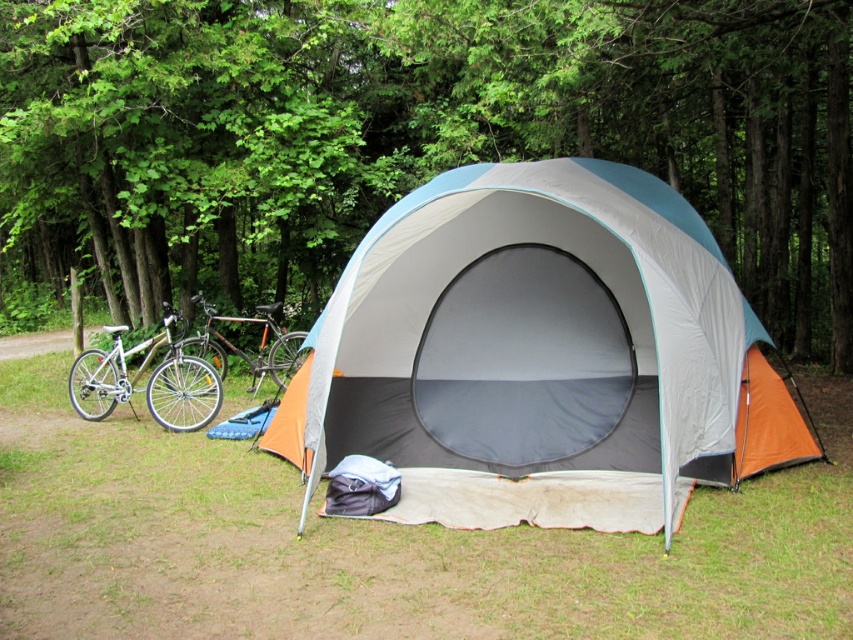
Is green leafy tree at center above shiny metallic bicycle at left?

Correct, green leafy tree at center is located above shiny metallic bicycle at left.

In the scene shown: Between green leafy tree at center and shiny metallic bicycle at left, which one is positioned lower?

shiny metallic bicycle at left is below.

Is point (285, 316) farther from viewer compared to point (190, 296)?

Yes, it is.

Locate an element on the screen. The height and width of the screenshot is (640, 853). green leafy tree at center is located at coordinates (407, 138).

Is orange fabric tent at center to the right of silver metallic bicycle at left from the viewer's perspective?

Correct, you'll find orange fabric tent at center to the right of silver metallic bicycle at left.

Who is more forward, (723, 476) or (77, 356)?

Point (723, 476) is more forward.

The width and height of the screenshot is (853, 640). In order to click on orange fabric tent at center in this screenshot , I will do `click(537, 349)`.

Describe the element at coordinates (381, 545) in the screenshot. I see `green grass at lower center` at that location.

Image resolution: width=853 pixels, height=640 pixels. Describe the element at coordinates (381, 545) in the screenshot. I see `green grass at lower center` at that location.

This screenshot has width=853, height=640. What are the coordinates of `green grass at lower center` in the screenshot? It's located at (381, 545).